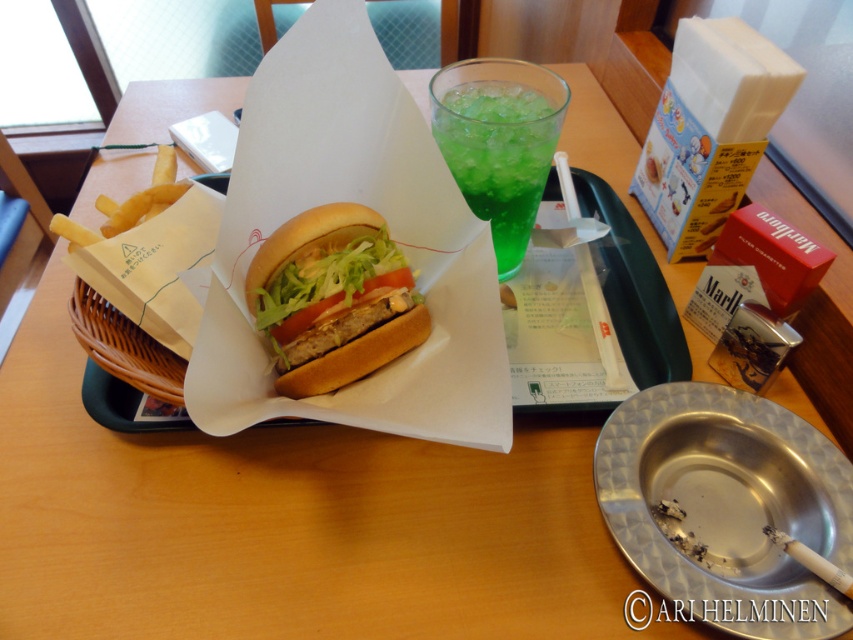
Who is taller, metallic ashtray at lower right or green translucent glass at upper center?

green translucent glass at upper center is taller.

Is point (679, 413) more distant than point (541, 172)?

No, (679, 413) is in front of (541, 172).

Where is `metallic ashtray at lower right`? metallic ashtray at lower right is located at coordinates (726, 508).

Can you confirm if golden brown bun at center is positioned above white paper burger at center?

Yes, golden brown bun at center is above white paper burger at center.

Does golden brown bun at center appear under white paper burger at center?

Actually, golden brown bun at center is above white paper burger at center.

I want to click on golden brown bun at center, so click(334, 298).

Does golden brown bun at center have a lesser width compared to green translucent glass at upper center?

In fact, golden brown bun at center might be wider than green translucent glass at upper center.

The image size is (853, 640). Describe the element at coordinates (334, 298) in the screenshot. I see `golden brown bun at center` at that location.

Image resolution: width=853 pixels, height=640 pixels. Find the location of `golden brown bun at center`. golden brown bun at center is located at coordinates (334, 298).